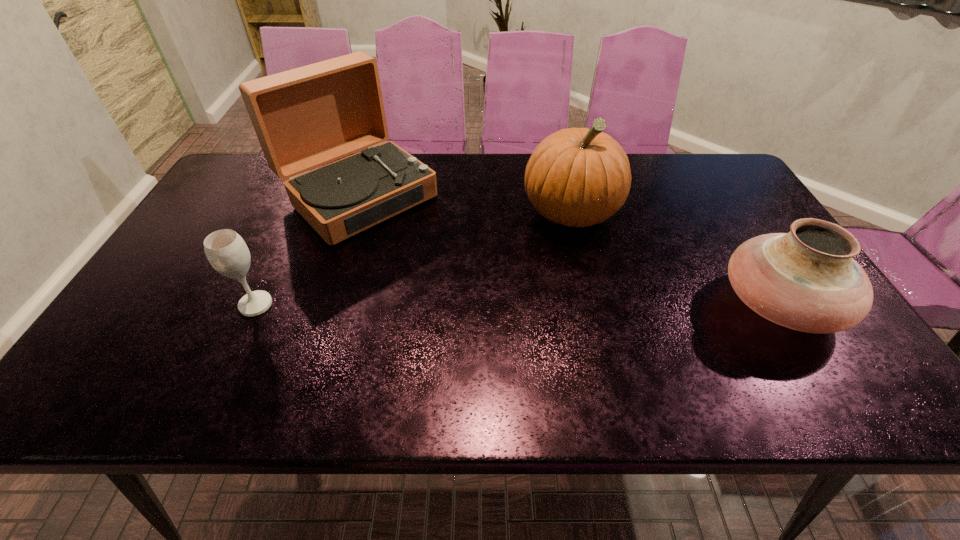
I want to click on object that is the second nearest to the second object from right to left, so click(306, 117).

Where is `the second closest object to the pumpkin`? the second closest object to the pumpkin is located at coordinates [x=306, y=117].

The width and height of the screenshot is (960, 540). Identify the location of blank space that satisfies the following two spatial constraints: 1. on the front side of the rightmost object; 2. on the left side of the pumpkin. pyautogui.click(x=592, y=305).

This screenshot has width=960, height=540. Identify the location of blank space that satisfies the following two spatial constraints: 1. on the back side of the pumpkin; 2. on the left side of the wineglass. (299, 212).

Identify the location of vacant region that satisfies the following two spatial constraints: 1. on the back side of the wineglass; 2. on the right side of the pumpkin. click(x=299, y=212).

This screenshot has width=960, height=540. In order to click on vacant area in the image that satisfies the following two spatial constraints: 1. on the front side of the phonograph record; 2. on the right side of the pottery in this screenshot , I will do `click(324, 305)`.

Identify the location of free space that satisfies the following two spatial constraints: 1. on the front side of the phonograph record; 2. on the left side of the pottery. This screenshot has width=960, height=540. (324, 305).